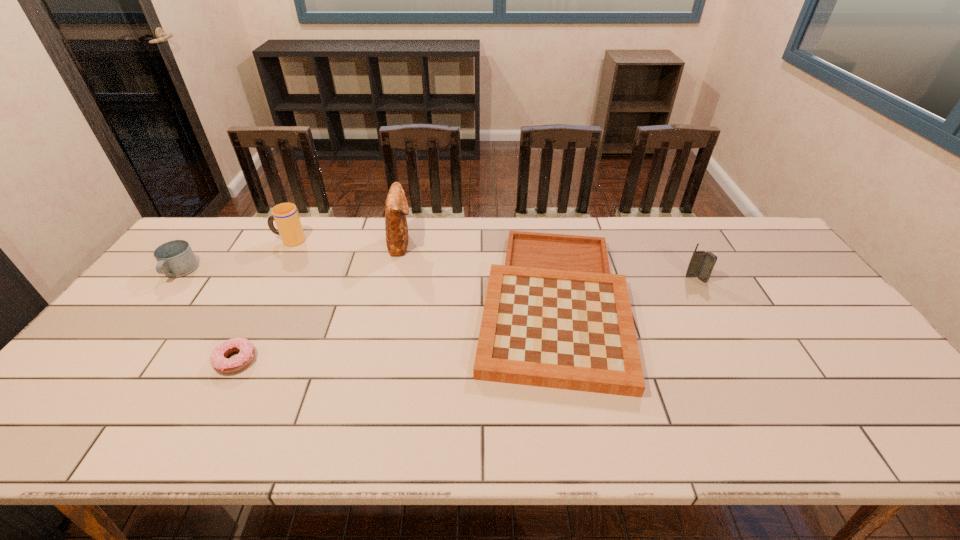
In order to click on vacant space that satisfies the following two spatial constraints: 1. on the open side of the tallest object; 2. on the side of the leftmost object with the handle in this screenshot , I will do `click(395, 272)`.

Find the location of a particular element. The width and height of the screenshot is (960, 540). free point that satisfies the following two spatial constraints: 1. on the side of the doughnut with the handle; 2. on the left side of the leftmost object is located at coordinates point(109,360).

Identify the location of free space that satisfies the following two spatial constraints: 1. on the side of the leftmost object with the handle; 2. on the left side of the doughnut. (109, 360).

In order to click on free region that satisfies the following two spatial constraints: 1. on the side of the gameboard with the handle; 2. on the left side of the mug in this screenshot , I will do `click(155, 302)`.